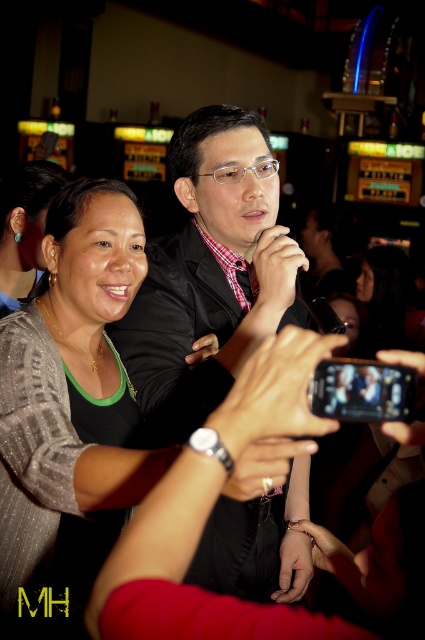
Question: Does sparkly silver blouse at center appear under turquoise gemstone earring at left?

Choices:
 (A) no
 (B) yes

Answer: (B)

Question: Among these objects, which one is nearest to the camera?

Choices:
 (A) turquoise gemstone earring at left
 (B) sparkly silver blouse at center

Answer: (B)

Question: Observing the image, what is the correct spatial positioning of sparkly silver blouse at center in reference to turquoise gemstone earring at left?

Choices:
 (A) above
 (B) below

Answer: (B)

Question: Which point is farther to the camera?

Choices:
 (A) (87, 586)
 (B) (39, 259)

Answer: (B)

Question: Does sparkly silver blouse at center have a larger size compared to turquoise gemstone earring at left?

Choices:
 (A) no
 (B) yes

Answer: (B)

Question: Which point appears closest to the camera in this image?

Choices:
 (A) (8, 531)
 (B) (0, 291)

Answer: (A)